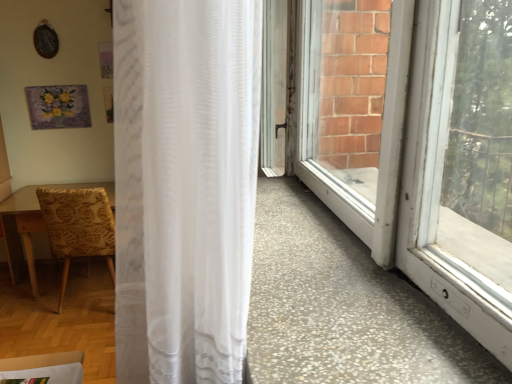
Question: Would you say patterned fabric chair at left is inside or outside white sheer curtain at center?

Choices:
 (A) inside
 (B) outside

Answer: (B)

Question: Considering the positions of patterned fabric chair at left and white sheer curtain at center in the image, is patterned fabric chair at left taller or shorter than white sheer curtain at center?

Choices:
 (A) tall
 (B) short

Answer: (B)

Question: Considering the positions of patterned fabric chair at left and white sheer curtain at center in the image, is patterned fabric chair at left wider or thinner than white sheer curtain at center?

Choices:
 (A) thin
 (B) wide

Answer: (B)

Question: Does point (114, 130) appear closer or farther from the camera than point (101, 188)?

Choices:
 (A) farther
 (B) closer

Answer: (B)

Question: Considering the positions of white sheer curtain at center and patterned fabric chair at left in the image, is white sheer curtain at center taller or shorter than patterned fabric chair at left?

Choices:
 (A) tall
 (B) short

Answer: (A)

Question: In terms of size, does white sheer curtain at center appear bigger or smaller than patterned fabric chair at left?

Choices:
 (A) small
 (B) big

Answer: (A)

Question: Would you say white sheer curtain at center is to the left or to the right of patterned fabric chair at left in the picture?

Choices:
 (A) left
 (B) right

Answer: (B)